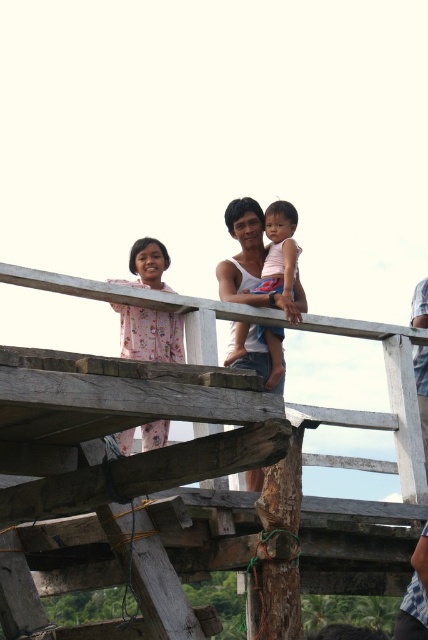
You are a photographer standing on the wooden structure and want to take a photo of the pink floral dress at upper left and the wooden at upper center. Can you fit both subjects in the frame if your camera has a 15 feet field of view?

The distance between the wooden at upper center and the pink floral dress at upper left is 12.89 feet, which is less than the camera field of view of 15 feet. Therefore, both subjects can be captured in the same frame.

You are a photographer trying to capture the wooden at upper center and the pink fabric at center in the same frame. Based on their sizes, which object should you focus on first to ensure both are visible in the photo?

The wooden at upper center is larger in size than the pink fabric at center, so you should focus on the wooden at upper center first to ensure both objects are visible in the photo.